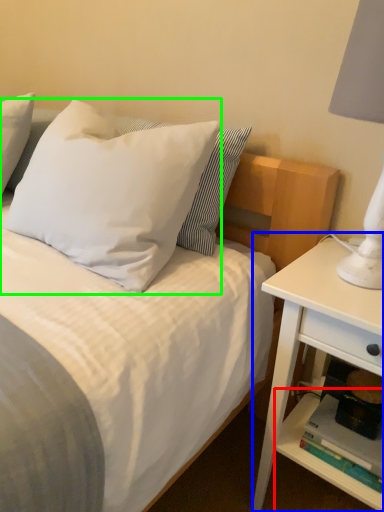
Question: Based on their relative distances, which object is farther from shelf (highlighted by a red box)? Choose from nightstand (highlighted by a blue box) and pillow (highlighted by a green box).

Choices:
 (A) nightstand
 (B) pillow

Answer: (B)